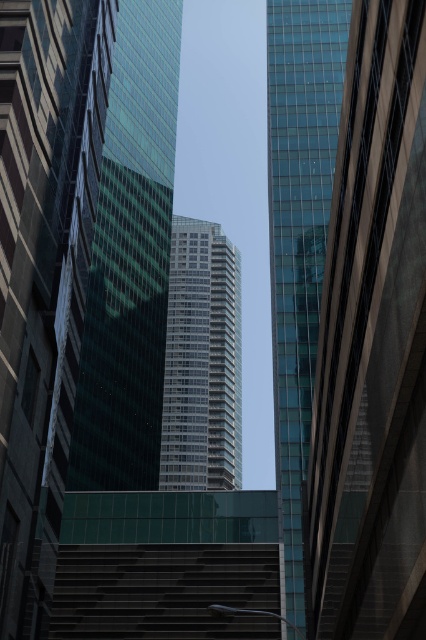
Question: Which of the following is the closest to the observer?

Choices:
 (A) (227, 564)
 (B) (236, 408)
 (C) (322, 230)

Answer: (A)

Question: Is transparent glass building at center further to camera compared to dark gray concrete stairs at lower center?

Choices:
 (A) no
 (B) yes

Answer: (A)

Question: Considering the real-world distances, which object is farthest from the dark gray concrete stairs at lower center?

Choices:
 (A) green glass building at center
 (B) glassy reflective skyscraper at right

Answer: (A)

Question: Is glassy reflective skyscraper at right smaller than green glass building at center?

Choices:
 (A) yes
 (B) no

Answer: (A)

Question: Which point appears farthest from the camera in this image?

Choices:
 (A) (141, 225)
 (B) (189, 296)
 (C) (281, 330)

Answer: (B)

Question: Is glassy reflective skyscraper at right bigger than dark gray concrete stairs at lower center?

Choices:
 (A) yes
 (B) no

Answer: (A)